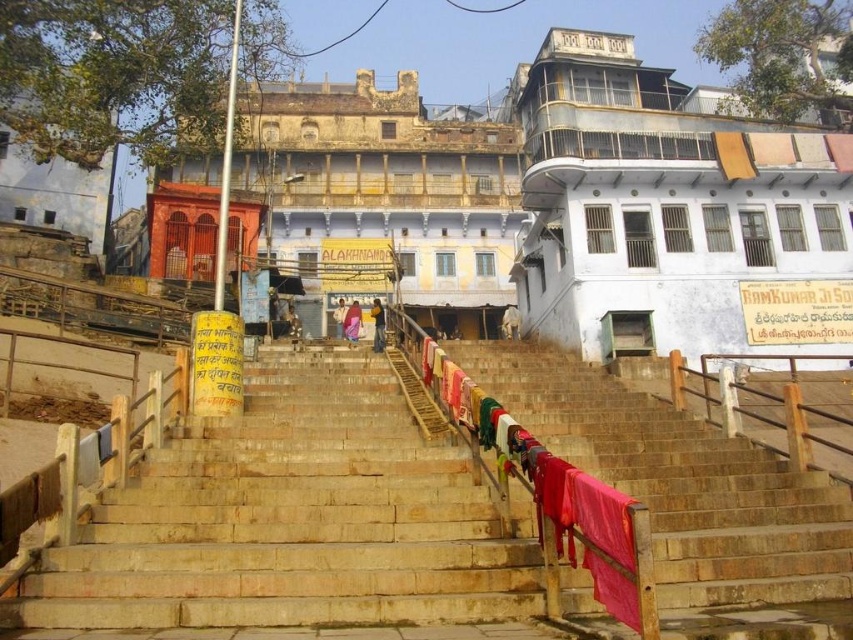
Between white plaster temple at center and white cotton cloth at center, which one is positioned lower?

white cotton cloth at center is lower down.

Which of these two, white plaster temple at center or white cotton cloth at center, stands taller?

Standing taller between the two is white plaster temple at center.

Image resolution: width=853 pixels, height=640 pixels. Find the location of `white plaster temple at center`. white plaster temple at center is located at coordinates (386, 193).

The image size is (853, 640). What do you see at coordinates (671, 212) in the screenshot?
I see `white painted building at upper right` at bounding box center [671, 212].

Is point (848, 342) positioned in front of point (376, 332)?

Yes, it is in front of point (376, 332).

Where is `white painted building at upper right`? white painted building at upper right is located at coordinates (671, 212).

Is purple fabric at center shorter than white cotton cloth at center?

Yes.

The height and width of the screenshot is (640, 853). What do you see at coordinates (352, 323) in the screenshot? I see `purple fabric at center` at bounding box center [352, 323].

Who is more forward, (345, 316) or (343, 314)?

Point (345, 316) is in front.

At what (x,y) coordinates should I click in order to perform the action: click on purple fabric at center. Please return your answer as a coordinate pair (x, y). The width and height of the screenshot is (853, 640). Looking at the image, I should click on (352, 323).